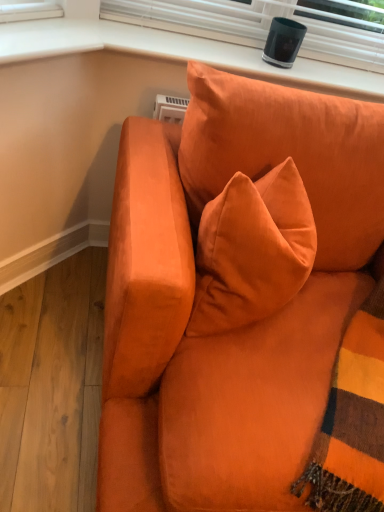
This screenshot has width=384, height=512. I want to click on blank space above matte black speaker at upper center (from a real-world perspective), so click(243, 45).